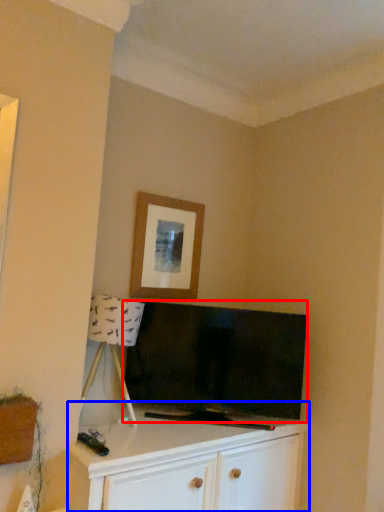
Question: Which point is closer to the camera, television (highlighted by a red box) or cabinetry (highlighted by a blue box)?

Choices:
 (A) television
 (B) cabinetry

Answer: (B)